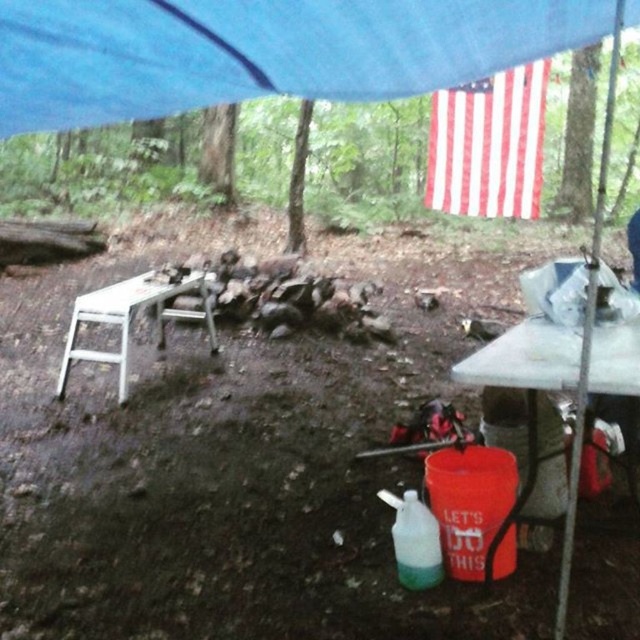
Between red and white striped fabric at upper right and orange plastic bucket at lower right, which one has less height?

Standing shorter between the two is orange plastic bucket at lower right.

From the picture: Who is more forward, (515, 93) or (570, 355)?

Point (570, 355) is in front.

Identify the location of red and white striped fabric at upper right. (488, 145).

Based on the photo, who is positioned more to the left, red and white striped fabric at upper right or white metallic table at left?

white metallic table at left

Does red and white striped fabric at upper right appear over white metallic table at left?

Indeed, red and white striped fabric at upper right is positioned over white metallic table at left.

Is point (536, 177) in front of point (163, 323)?

No, (536, 177) is further to viewer.

You are a GUI agent. You are given a task and a screenshot of the screen. Output one action in this format:
    pyautogui.click(x=<x>, y=<y>)
    Task: Click on the red and white striped fabric at upper right
    
    Given the screenshot: What is the action you would take?
    pyautogui.click(x=488, y=145)

Locate an element on the screen. orange plastic bucket at lower right is located at coordinates (560, 388).

Does orange plastic bucket at lower right have a greater width compared to white metallic table at left?

No, orange plastic bucket at lower right is not wider than white metallic table at left.

Does point (621, 365) lie behind point (92, 358)?

No, (621, 365) is in front of (92, 358).

This screenshot has width=640, height=640. Find the location of `orange plastic bucket at lower right`. orange plastic bucket at lower right is located at coordinates (560, 388).